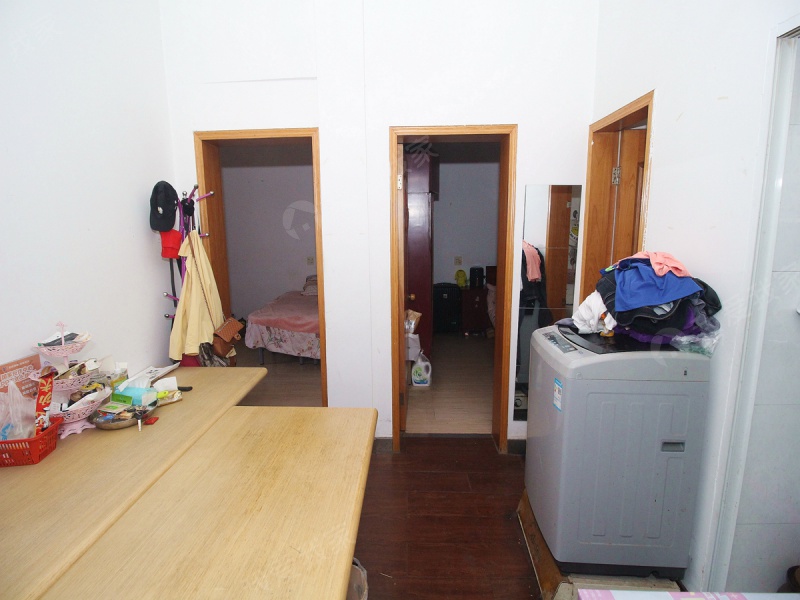
Where is `gray washing machine`? The height and width of the screenshot is (600, 800). gray washing machine is located at coordinates (634, 427).